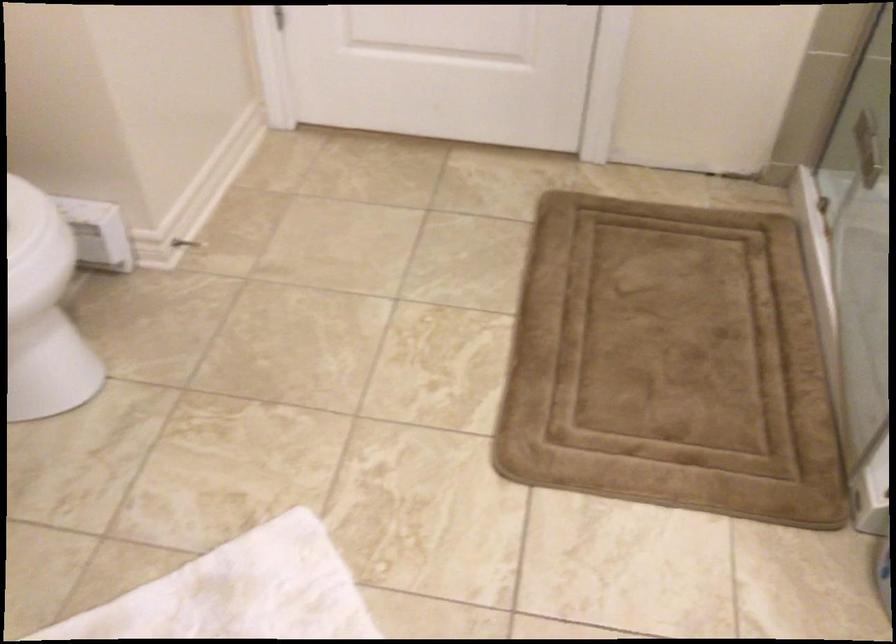
What do you see at coordinates (274, 17) in the screenshot?
I see `the metal doorstop` at bounding box center [274, 17].